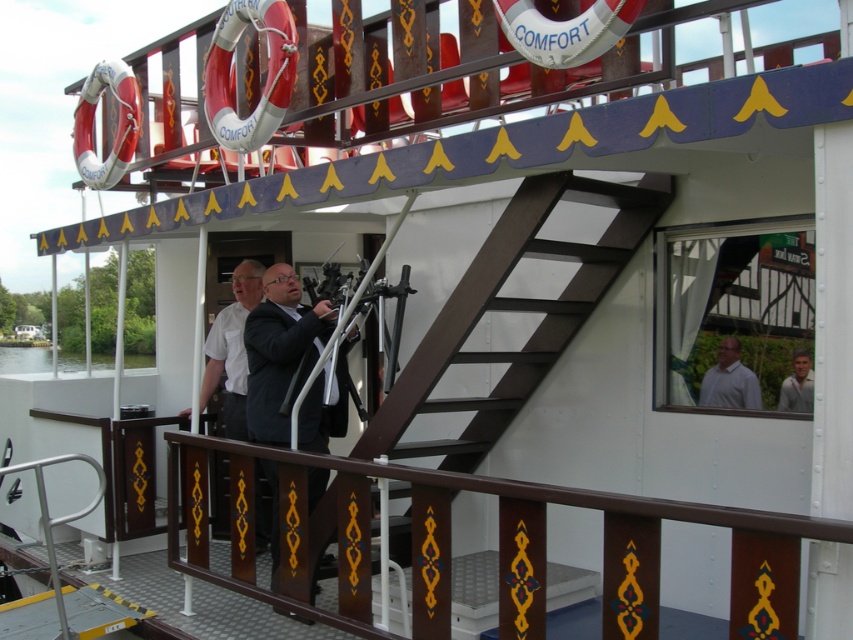
Measure the distance from clear water at lower left to light brown leather jacket at upper right.

13.12 meters

Can you confirm if clear water at lower left is smaller than light brown leather jacket at upper right?

Incorrect, clear water at lower left is not smaller in size than light brown leather jacket at upper right.

Is point (49, 364) positioned before point (805, 385)?

That is False.

Locate an element on the screen. clear water at lower left is located at coordinates (24, 358).

Looking at this image, which of these two, white matte shirt at center or white matte shirt at upper right, stands shorter?

With less height is white matte shirt at upper right.

Describe the element at coordinates (231, 348) in the screenshot. I see `white matte shirt at center` at that location.

Image resolution: width=853 pixels, height=640 pixels. Identify the location of white matte shirt at center. (231, 348).

Locate an element on the screen. The height and width of the screenshot is (640, 853). white matte shirt at center is located at coordinates (231, 348).

Can you confirm if dark gray suit at center is thinner than light brown leather jacket at upper right?

In fact, dark gray suit at center might be wider than light brown leather jacket at upper right.

Can you confirm if dark gray suit at center is taller than light brown leather jacket at upper right?

Yes.

Find the location of a particular element. This screenshot has width=853, height=640. dark gray suit at center is located at coordinates (280, 349).